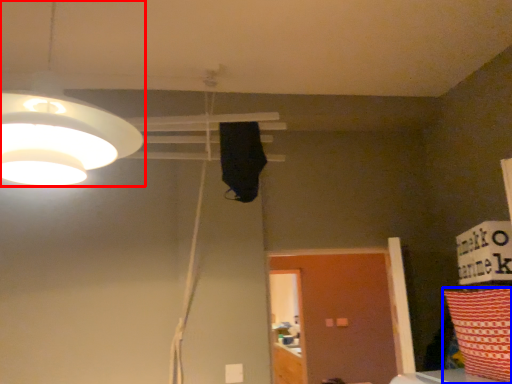
Question: Which object is closer to the camera taking this photo, lamp (highlighted by a red box) or pillow (highlighted by a blue box)?

Choices:
 (A) lamp
 (B) pillow

Answer: (A)